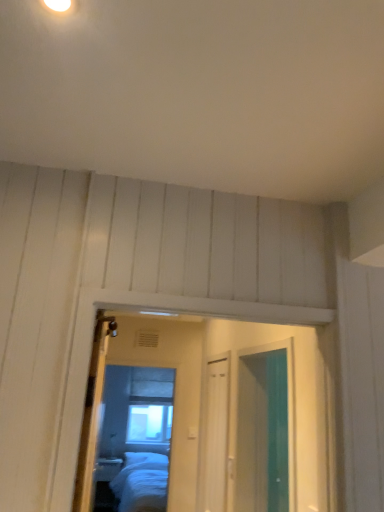
Question: Can you confirm if wooden door at center is smaller than matte glass mirror at center?

Choices:
 (A) no
 (B) yes

Answer: (A)

Question: Are wooden door at center and matte glass mirror at center far apart?

Choices:
 (A) no
 (B) yes

Answer: (B)

Question: Can you confirm if wooden door at center is thinner than matte glass mirror at center?

Choices:
 (A) no
 (B) yes

Answer: (A)

Question: Is wooden door at center taller than matte glass mirror at center?

Choices:
 (A) yes
 (B) no

Answer: (B)

Question: Can you confirm if wooden door at center is shorter than matte glass mirror at center?

Choices:
 (A) yes
 (B) no

Answer: (A)

Question: Considering the positions of wooden door at center and clear glass window at center in the image, is wooden door at center wider or thinner than clear glass window at center?

Choices:
 (A) thin
 (B) wide

Answer: (B)

Question: From the image's perspective, is wooden door at center above or below clear glass window at center?

Choices:
 (A) below
 (B) above

Answer: (B)

Question: From a real-world perspective, relative to clear glass window at center, is wooden door at center vertically above or below?

Choices:
 (A) below
 (B) above

Answer: (B)

Question: Considering the relative positions of wooden door at center and clear glass window at center in the image provided, is wooden door at center to the left or to the right of clear glass window at center?

Choices:
 (A) left
 (B) right

Answer: (B)

Question: Does point (137, 407) appear closer or farther from the camera than point (92, 376)?

Choices:
 (A) closer
 (B) farther

Answer: (B)

Question: Relative to wooden door at center, is clear glass window at center in front or behind?

Choices:
 (A) behind
 (B) front

Answer: (A)

Question: From the image's perspective, is clear glass window at center above or below wooden door at center?

Choices:
 (A) above
 (B) below

Answer: (B)

Question: Looking at the image, does clear glass window at center seem bigger or smaller compared to wooden door at center?

Choices:
 (A) small
 (B) big

Answer: (A)

Question: Relative to matte glass mirror at center, is wooden door at center in front or behind?

Choices:
 (A) behind
 (B) front

Answer: (B)

Question: In the image, is wooden door at center on the left side or the right side of matte glass mirror at center?

Choices:
 (A) left
 (B) right

Answer: (B)